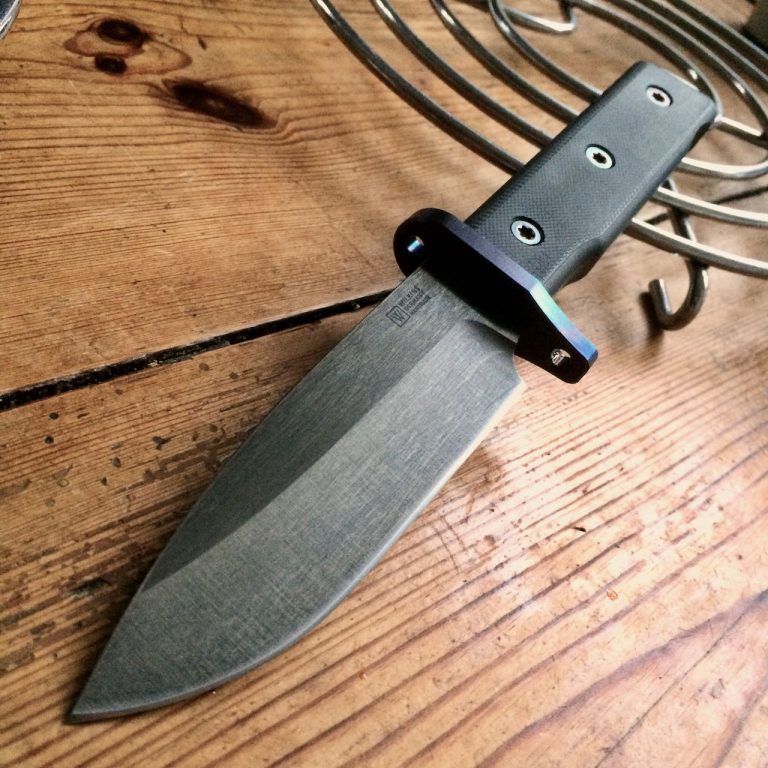
At what (x,y) coordinates should I click in order to perform the action: click on screws. Please return your answer as a coordinate pair (x, y). Looking at the image, I should click on (525, 232), (598, 154), (660, 94).